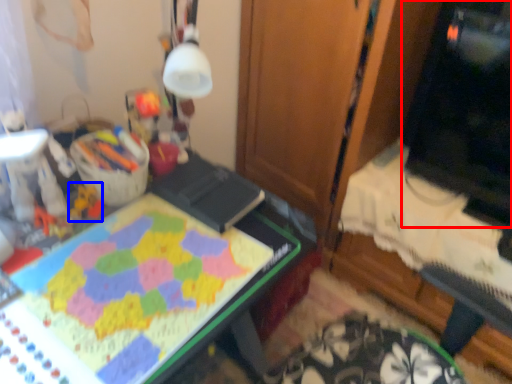
Question: Which of the following is the closest to the observer, computer monitor (highlighted by a red box) or toy (highlighted by a blue box)?

Choices:
 (A) computer monitor
 (B) toy

Answer: (B)